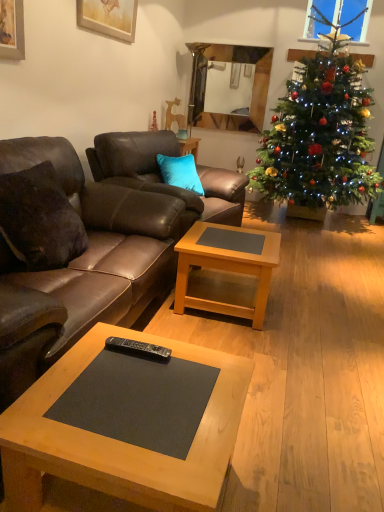
Locate an element on the screen. Image resolution: width=384 pixels, height=512 pixels. vacant area that is situated to the right of light brown wooden coffee table at center, which is the 2th coffee table from front to back is located at coordinates (302, 316).